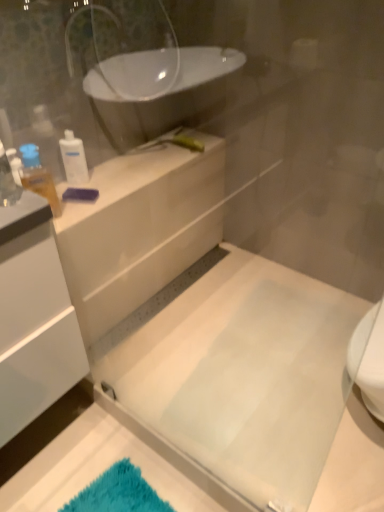
This screenshot has height=512, width=384. Identify the location of white plastic bottle at upper left, positioned as the 2th toiletry in front-to-back order. (74, 159).

In order to face white glossy counter at upper left, should I rotate leftwards or rightwards?

Rotate your view left by about 7.987°.

This screenshot has width=384, height=512. What are the coordinates of `translucent plastic bottle at upper left, which is counted as the 1th toiletry, starting from the front` in the screenshot? It's located at (38, 177).

Is the depth of white glossy counter at upper left less than that of white plastic bottle at upper left, positioned as the 2th toiletry in front-to-back order?

Yes, the depth of white glossy counter at upper left is less than that of white plastic bottle at upper left, positioned as the 2th toiletry in front-to-back order.

Is white glossy counter at upper left smaller than white plastic bottle at upper left, positioned as the 2th toiletry in front-to-back order?

No, white glossy counter at upper left is not smaller than white plastic bottle at upper left, positioned as the 2th toiletry in front-to-back order.

Is white glossy counter at upper left with white plastic bottle at upper left, which is the 1th toiletry in back-to-front order?

There is a gap between white glossy counter at upper left and white plastic bottle at upper left, which is the 1th toiletry in back-to-front order.

Is white glossy counter at upper left at the left side of white plastic bottle at upper left, which is the 1th toiletry in back-to-front order?

In fact, white glossy counter at upper left is to the right of white plastic bottle at upper left, which is the 1th toiletry in back-to-front order.

Locate an element on the screen. The width and height of the screenshot is (384, 512). the 1st toiletry to the left when counting from the white glossy counter at upper left is located at coordinates (74, 159).

Is white plastic bottle at upper left, positioned as the 2th toiletry in front-to-back order, completely or partially outside of white glossy counter at upper left?

Absolutely, white plastic bottle at upper left, positioned as the 2th toiletry in front-to-back order, is external to white glossy counter at upper left.

Is white plastic bottle at upper left, positioned as the 2th toiletry in front-to-back order, positioned far away from white glossy counter at upper left?

white plastic bottle at upper left, positioned as the 2th toiletry in front-to-back order, is near white glossy counter at upper left, not far away.

Which of these two, white plastic bottle at upper left, which is the 1th toiletry in back-to-front order, or white glossy counter at upper left, is smaller?

With smaller size is white plastic bottle at upper left, which is the 1th toiletry in back-to-front order.

Could you tell me if translucent plastic bottle at upper left, which is counted as the second toiletry, starting from the back, is turned towards white plastic bottle at upper left, positioned as the 2th toiletry in front-to-back order?

No.

From the image's perspective, would you say translucent plastic bottle at upper left, which is counted as the 1th toiletry, starting from the front, is shown under white plastic bottle at upper left, which is the 1th toiletry in back-to-front order?

Yes, from the image's perspective, translucent plastic bottle at upper left, which is counted as the 1th toiletry, starting from the front, is below white plastic bottle at upper left, which is the 1th toiletry in back-to-front order.

Is translucent plastic bottle at upper left, which is counted as the second toiletry, starting from the back, at the left side of white plastic bottle at upper left, positioned as the 2th toiletry in front-to-back order?

Yes.

Can white plastic bottle at upper left, which is the 1th toiletry in back-to-front order, be found inside translucent plastic bottle at upper left, which is counted as the 1th toiletry, starting from the front?

No, white plastic bottle at upper left, which is the 1th toiletry in back-to-front order, is not surrounded by translucent plastic bottle at upper left, which is counted as the 1th toiletry, starting from the front.

Is translucent plastic bottle at upper left, which is counted as the second toiletry, starting from the back, inside white glossy counter at upper left?

No, translucent plastic bottle at upper left, which is counted as the second toiletry, starting from the back, is not a part of white glossy counter at upper left.

Could you tell me if white glossy counter at upper left is turned towards translucent plastic bottle at upper left, which is counted as the 1th toiletry, starting from the front?

No, white glossy counter at upper left does not turn towards translucent plastic bottle at upper left, which is counted as the 1th toiletry, starting from the front.

Which object is further away from the camera, white glossy counter at upper left or translucent plastic bottle at upper left, which is counted as the 1th toiletry, starting from the front?

white glossy counter at upper left is more distant.

Is point (20, 146) closer to viewer compared to point (190, 234)?

Yes.

From the picture: Is translucent plastic bottle at upper left, which is counted as the 1th toiletry, starting from the front, next to white glossy counter at upper left?

They are not placed beside each other.

Find the location of a particular element. toiletry below the white glossy counter at upper left (from the image's perspective) is located at coordinates (38, 177).

From the image's perspective, which one is positioned higher, translucent plastic bottle at upper left, which is counted as the 1th toiletry, starting from the front, or white glossy counter at upper left?

white glossy counter at upper left, from the image's perspective.

Is white plastic bottle at upper left, which is the 1th toiletry in back-to-front order, facing away from translucent plastic bottle at upper left, which is counted as the second toiletry, starting from the back?

No.

Is there a large distance between white plastic bottle at upper left, positioned as the 2th toiletry in front-to-back order, and translucent plastic bottle at upper left, which is counted as the second toiletry, starting from the back?

No, white plastic bottle at upper left, positioned as the 2th toiletry in front-to-back order, is in close proximity to translucent plastic bottle at upper left, which is counted as the second toiletry, starting from the back.

Is white plastic bottle at upper left, positioned as the 2th toiletry in front-to-back order, at the right side of translucent plastic bottle at upper left, which is counted as the 1th toiletry, starting from the front?

Correct, you'll find white plastic bottle at upper left, positioned as the 2th toiletry in front-to-back order, to the right of translucent plastic bottle at upper left, which is counted as the 1th toiletry, starting from the front.

Considering the sizes of objects white plastic bottle at upper left, which is the 1th toiletry in back-to-front order, and translucent plastic bottle at upper left, which is counted as the second toiletry, starting from the back, in the image provided, who is bigger, white plastic bottle at upper left, which is the 1th toiletry in back-to-front order, or translucent plastic bottle at upper left, which is counted as the second toiletry, starting from the back,?

With larger size is translucent plastic bottle at upper left, which is counted as the second toiletry, starting from the back.

Identify the location of counter top in front of the white plastic bottle at upper left, positioned as the 2th toiletry in front-to-back order. Image resolution: width=384 pixels, height=512 pixels. (141, 213).

Image resolution: width=384 pixels, height=512 pixels. Identify the location of counter top on the right of white plastic bottle at upper left, positioned as the 2th toiletry in front-to-back order. (141, 213).

Considering their positions, is white glossy counter at upper left positioned further to translucent plastic bottle at upper left, which is counted as the 1th toiletry, starting from the front, than white plastic bottle at upper left, which is the 1th toiletry in back-to-front order?

white glossy counter at upper left is positioned further to the anchor translucent plastic bottle at upper left, which is counted as the 1th toiletry, starting from the front.

From the image, which object appears to be nearer to translucent plastic bottle at upper left, which is counted as the second toiletry, starting from the back, white plastic bottle at upper left, which is the 1th toiletry in back-to-front order, or white glossy counter at upper left?

white plastic bottle at upper left, which is the 1th toiletry in back-to-front order, lies closer to translucent plastic bottle at upper left, which is counted as the second toiletry, starting from the back, than the other object.

When comparing their distances from white glossy counter at upper left, does white plastic bottle at upper left, which is the 1th toiletry in back-to-front order, or translucent plastic bottle at upper left, which is counted as the second toiletry, starting from the back, seem further?

translucent plastic bottle at upper left, which is counted as the second toiletry, starting from the back, is further to white glossy counter at upper left.

From the picture: Considering their positions, is translucent plastic bottle at upper left, which is counted as the 1th toiletry, starting from the front, positioned further to white plastic bottle at upper left, which is the 1th toiletry in back-to-front order, than white glossy counter at upper left?

Based on the image, white glossy counter at upper left appears to be further to white plastic bottle at upper left, which is the 1th toiletry in back-to-front order.

When comparing their distances from white glossy counter at upper left, does translucent plastic bottle at upper left, which is counted as the second toiletry, starting from the back, or white plastic bottle at upper left, which is the 1th toiletry in back-to-front order, seem further?

Based on the image, translucent plastic bottle at upper left, which is counted as the second toiletry, starting from the back, appears to be further to white glossy counter at upper left.

From the image, which object appears to be farther from white plastic bottle at upper left, which is the 1th toiletry in back-to-front order, white glossy counter at upper left or translucent plastic bottle at upper left, which is counted as the second toiletry, starting from the back?

Among the two, white glossy counter at upper left is located further to white plastic bottle at upper left, which is the 1th toiletry in back-to-front order.

Where is `toiletry between translucent plastic bottle at upper left, which is counted as the second toiletry, starting from the back, and white glossy counter at upper left from left to right`? The width and height of the screenshot is (384, 512). toiletry between translucent plastic bottle at upper left, which is counted as the second toiletry, starting from the back, and white glossy counter at upper left from left to right is located at coordinates (74, 159).